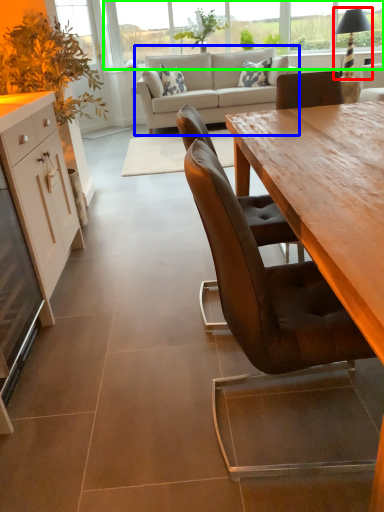
Question: Considering the real-world distances, which object is farthest from lamp (highlighted by a red box)? studio couch (highlighted by a blue box) or window (highlighted by a green box)?

Choices:
 (A) studio couch
 (B) window

Answer: (B)